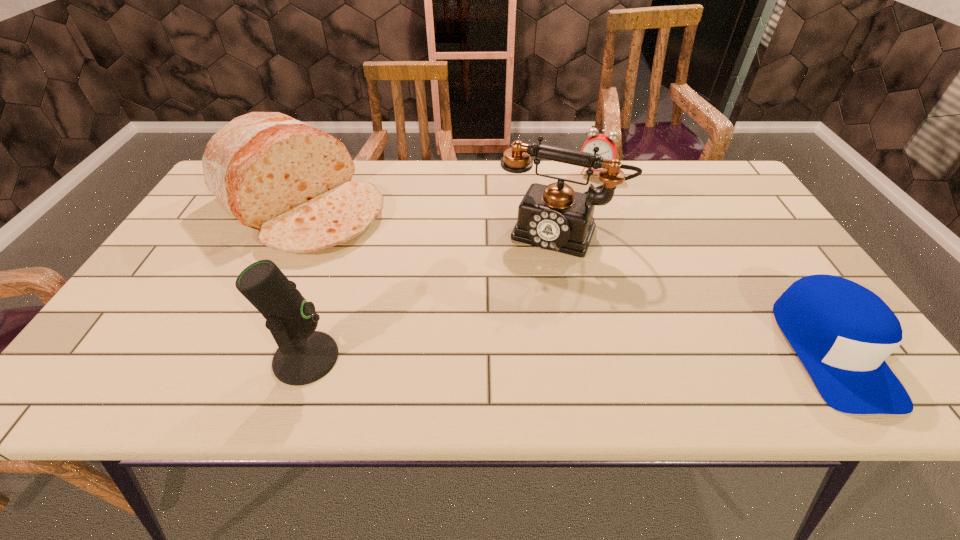
The width and height of the screenshot is (960, 540). I want to click on unoccupied position between the rightmost object and the microphone, so click(x=568, y=354).

The width and height of the screenshot is (960, 540). I want to click on vacant area that lies between the bread and the microphone, so click(x=304, y=281).

Where is `empty location between the alarm clock and the baseball cap`? empty location between the alarm clock and the baseball cap is located at coordinates (712, 261).

Locate an element on the screen. free space that is in between the baseball cap and the alarm clock is located at coordinates (712, 261).

Where is `vacant area that lies between the telephone and the baseball cap`? The image size is (960, 540). vacant area that lies between the telephone and the baseball cap is located at coordinates (695, 292).

Locate an element on the screen. free spot between the bread and the microphone is located at coordinates (304, 281).

Find the location of `vacant area that lies between the microphone and the bread`. vacant area that lies between the microphone and the bread is located at coordinates (304, 281).

Where is `the third closest object to the microphone`? The width and height of the screenshot is (960, 540). the third closest object to the microphone is located at coordinates (607, 147).

Locate an element on the screen. Image resolution: width=960 pixels, height=540 pixels. object identified as the third closest to the microphone is located at coordinates (607, 147).

You are a GUI agent. You are given a task and a screenshot of the screen. Output one action in this format:
    pyautogui.click(x=<x>, y=<y>)
    Task: Click on the vacant space that satisfies the following two spatial constraints: 1. on the front side of the telephone; 2. on the left side of the bread
    Image resolution: width=960 pixels, height=540 pixels.
    Given the screenshot: What is the action you would take?
    pyautogui.click(x=289, y=233)